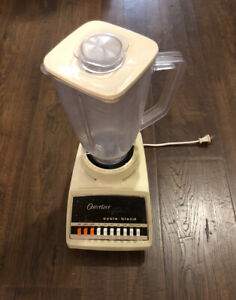
Image resolution: width=236 pixels, height=300 pixels. What are the coordinates of `blender` in the screenshot? It's located at (89, 199).